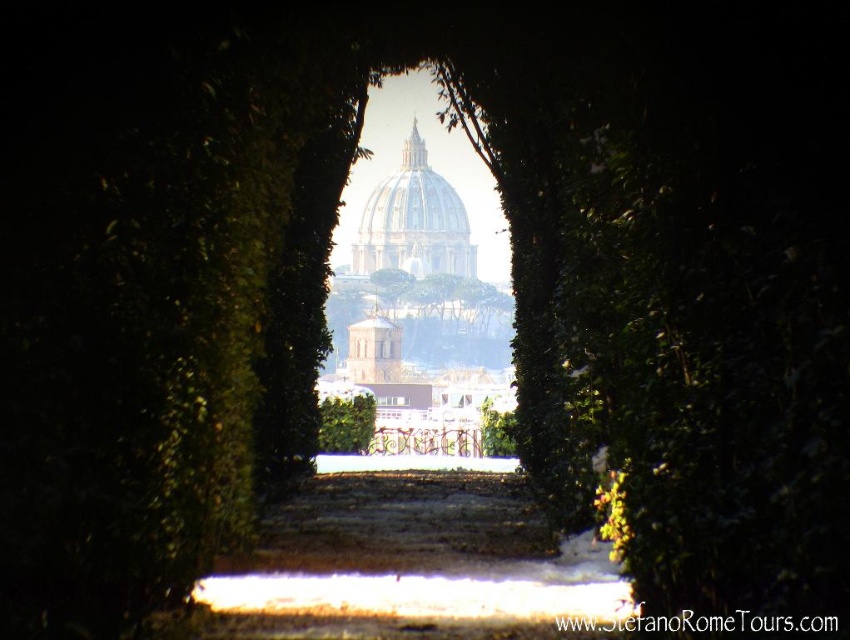
Question: Can you confirm if green leafy hedge at center is smaller than green leafy tree at center?

Choices:
 (A) no
 (B) yes

Answer: (A)

Question: Which point appears farthest from the camera in this image?

Choices:
 (A) (378, 269)
 (B) (343, 406)

Answer: (A)

Question: Is the position of white marble dome at center more distant than that of green leafy hedge at center?

Choices:
 (A) no
 (B) yes

Answer: (B)

Question: Is green leafy hedge at center wider than green leafy tree at center?

Choices:
 (A) yes
 (B) no

Answer: (B)

Question: Based on their relative distances, which object is nearer to the green leafy hedge at center?

Choices:
 (A) white marble dome at center
 (B) green leafy tree at center

Answer: (B)

Question: Which point appears closest to the camera in this image?

Choices:
 (A) (381, 284)
 (B) (414, 172)

Answer: (A)